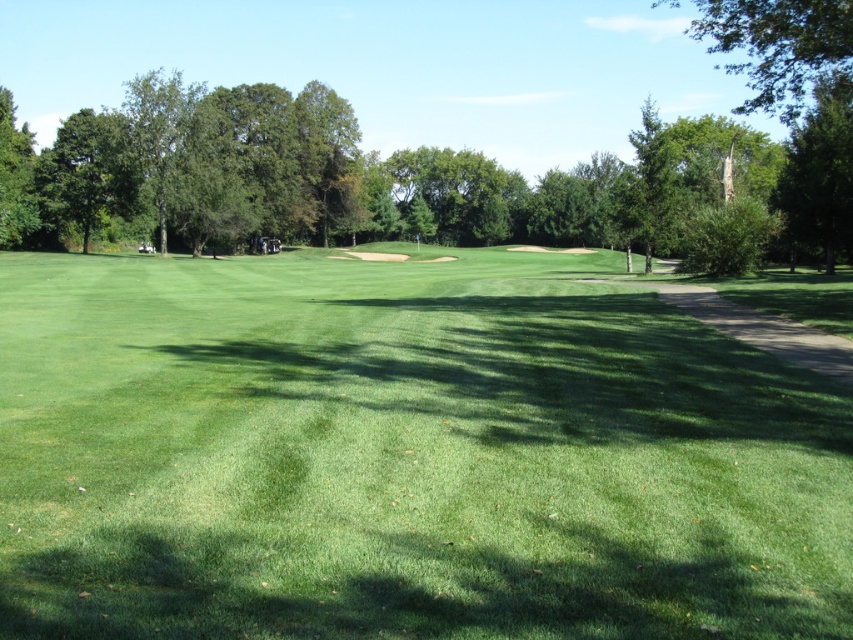
In the scene shown: Is green leafy tree at upper right thinner than green leafy tree at left?

No.

Does green leafy tree at upper right appear on the right side of green leafy tree at left?

Indeed, green leafy tree at upper right is positioned on the right side of green leafy tree at left.

Describe the element at coordinates (779, 48) in the screenshot. I see `green leafy tree at upper right` at that location.

The height and width of the screenshot is (640, 853). What are the coordinates of `green leafy tree at upper right` in the screenshot? It's located at (779, 48).

Does green grassy field at center have a greater width compared to green leafy tree at left?

Yes, green grassy field at center is wider than green leafy tree at left.

Can you confirm if green grassy field at center is shorter than green leafy tree at left?

Yes, green grassy field at center is shorter than green leafy tree at left.

Image resolution: width=853 pixels, height=640 pixels. What do you see at coordinates (404, 456) in the screenshot?
I see `green grassy field at center` at bounding box center [404, 456].

The width and height of the screenshot is (853, 640). I want to click on green grassy field at center, so click(404, 456).

This screenshot has height=640, width=853. Describe the element at coordinates (404, 456) in the screenshot. I see `green grassy field at center` at that location.

Is point (152, 541) positioned in front of point (762, 19)?

Yes, it is in front of point (762, 19).

Find the location of `green grassy field at center`. green grassy field at center is located at coordinates (404, 456).